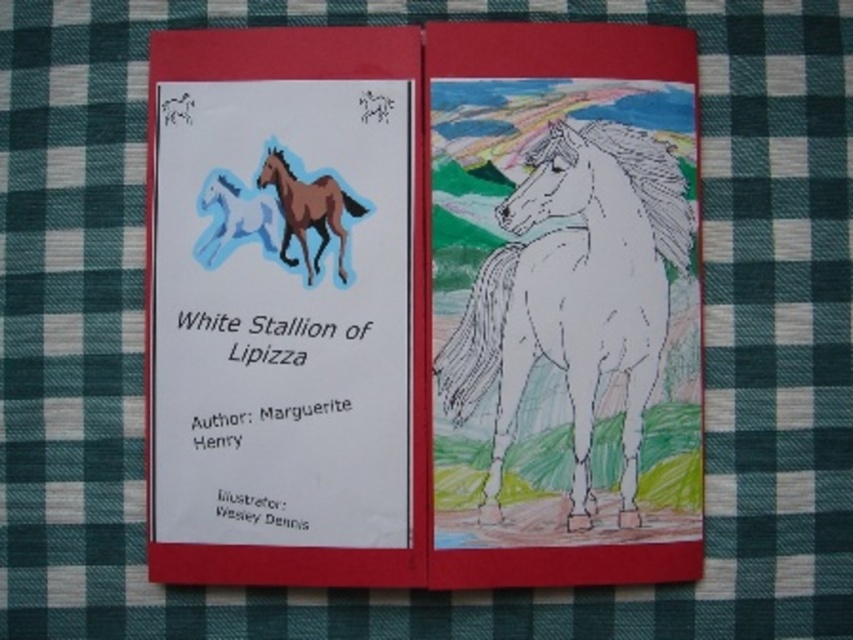
Between white paper horse at center and brown glossy horse at upper left, which one appears on the left side from the viewer's perspective?

brown glossy horse at upper left is more to the left.

Is white paper horse at center wider than brown glossy horse at upper left?

Yes, white paper horse at center is wider than brown glossy horse at upper left.

Is point (509, 305) positioned after point (287, 179)?

No, (509, 305) is in front of (287, 179).

The width and height of the screenshot is (853, 640). I want to click on white paper horse at center, so (x=573, y=305).

Can you confirm if white paper horse at center is taller than blue paper horse at upper left?

Yes, white paper horse at center is taller than blue paper horse at upper left.

I want to click on white paper horse at center, so click(x=573, y=305).

In the scene shown: Is brown glossy horse at upper left below blue paper horse at upper left?

Actually, brown glossy horse at upper left is above blue paper horse at upper left.

Is brown glossy horse at upper left positioned in front of blue paper horse at upper left?

Yes, it is.

Which is in front, point (286, 205) or point (215, 250)?

Point (286, 205)

The height and width of the screenshot is (640, 853). Identify the location of brown glossy horse at upper left. (308, 211).